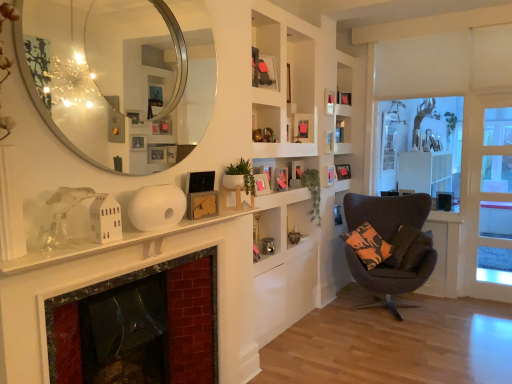
In order to face wooden picture frame at upper center, placed as the fifth picture frame when sorted from front to back, should I rotate leftwards or rightwards?

Rotate right and turn 10.078 degrees.

The image size is (512, 384). What do you see at coordinates (117, 243) in the screenshot? I see `white matte fireplace mantle at center` at bounding box center [117, 243].

The height and width of the screenshot is (384, 512). What do you see at coordinates (120, 77) in the screenshot?
I see `silver/metallic mirror at upper left` at bounding box center [120, 77].

This screenshot has width=512, height=384. Describe the element at coordinates (345, 98) in the screenshot. I see `matte black picture frame at upper center, the 8th picture frame positioned from the left` at that location.

What are the coordinates of `matte black picture frame at upper center, which is the eighth picture frame in front-to-back order` in the screenshot? It's located at [x=345, y=98].

The image size is (512, 384). What do you see at coordinates (303, 128) in the screenshot?
I see `wooden picture frame at upper center, the 4th picture frame viewed from the front` at bounding box center [303, 128].

Locate an element on the screen. Image resolution: width=512 pixels, height=384 pixels. matte wooden picture frame at upper center, which ranks as the 9th picture frame in front-to-back order is located at coordinates (343, 171).

You are a GUI agent. You are given a task and a screenshot of the screen. Output one action in this format:
    pyautogui.click(x=<x>, y=<y>)
    Task: Click on the wooden picture frame at upper center, arranged as the fourth picture frame when viewed from the right
    The height and width of the screenshot is (384, 512).
    Given the screenshot: What is the action you would take?
    pyautogui.click(x=330, y=101)

From the picture: How much distance is there between silver/metallic mirror at upper left and wooden picture frame at upper center, which appears as the sixth picture frame when viewed from the back?

The distance of silver/metallic mirror at upper left from wooden picture frame at upper center, which appears as the sixth picture frame when viewed from the back, is 1.68 meters.

Which picture frame is the 4th one when counting from the back of the silver/metallic mirror at upper left? Please provide its 2D coordinates.

[(303, 128)]

Which object is positioned more to the right, silver/metallic mirror at upper left or wooden picture frame at upper center, which appears as the sixth picture frame when viewed from the back?

From the viewer's perspective, wooden picture frame at upper center, which appears as the sixth picture frame when viewed from the back, appears more on the right side.

Does point (145, 75) come behind point (308, 132)?

No.

Is orange-patterned fabric pillow at lower right facing towards clear glass door at right?

No.

Which is in front, orange-patterned fabric pillow at lower right or clear glass door at right?

orange-patterned fabric pillow at lower right is more forward.

Does orange-patterned fabric pillow at lower right have a greater height compared to clear glass door at right?

In fact, orange-patterned fabric pillow at lower right may be shorter than clear glass door at right.

Does matte black picture frame at upper center, the 8th picture frame positioned from the left, come in front of wooden picture frame at center, the 2th picture frame when ordered from front to back?

No, matte black picture frame at upper center, the 8th picture frame positioned from the left, is further to the viewer.

Considering the sizes of matte black picture frame at upper center, which is the 2th picture frame in right-to-left order, and wooden picture frame at center, the 8th picture frame when ordered from back to front, in the image, is matte black picture frame at upper center, which is the 2th picture frame in right-to-left order, taller or shorter than wooden picture frame at center, the 8th picture frame when ordered from back to front,?

Clearly, matte black picture frame at upper center, which is the 2th picture frame in right-to-left order, is shorter compared to wooden picture frame at center, the 8th picture frame when ordered from back to front.

Considering the positions of objects matte black picture frame at upper center, which is the eighth picture frame in front-to-back order, and wooden picture frame at center, the 8th picture frame when ordered from back to front, in the image provided, who is more to the right, matte black picture frame at upper center, which is the eighth picture frame in front-to-back order, or wooden picture frame at center, the 8th picture frame when ordered from back to front,?

matte black picture frame at upper center, which is the eighth picture frame in front-to-back order, is more to the right.

How distant is matte black picture frame at upper center, which is the eighth picture frame in front-to-back order, from wooden picture frame at center, the 8th picture frame when ordered from back to front?

The distance of matte black picture frame at upper center, which is the eighth picture frame in front-to-back order, from wooden picture frame at center, the 8th picture frame when ordered from back to front, is 5.34 feet.

From a real-world perspective, is wooden picture frame at center, which is the seventh picture frame from right to left, under silver/metallic mirror at upper left?

Yes, from a real-world perspective, wooden picture frame at center, which is the seventh picture frame from right to left, is under silver/metallic mirror at upper left.

Considering the sizes of objects wooden picture frame at center, which ranks as the third picture frame in front-to-back order, and silver/metallic mirror at upper left in the image provided, who is thinner, wooden picture frame at center, which ranks as the third picture frame in front-to-back order, or silver/metallic mirror at upper left?

wooden picture frame at center, which ranks as the third picture frame in front-to-back order.

Consider the image. What's the angular difference between wooden picture frame at center, which appears as the 3th picture frame when viewed from the left, and silver/metallic mirror at upper left's facing directions?

0.862 degrees.

Is silver/metallic mirror at upper left located within wooden picture frame at center, positioned as the 7th picture frame in back-to-front order?

No, silver/metallic mirror at upper left is not surrounded by wooden picture frame at center, positioned as the 7th picture frame in back-to-front order.

Can you confirm if wooden picture frame at upper center, the 7th picture frame viewed from the front, is wider than smooth black glass fireplace at lower left?

Incorrect, the width of wooden picture frame at upper center, the 7th picture frame viewed from the front, does not surpass that of smooth black glass fireplace at lower left.

Could you tell me if wooden picture frame at upper center, the 7th picture frame viewed from the front, is facing smooth black glass fireplace at lower left?

No, wooden picture frame at upper center, the 7th picture frame viewed from the front, is not turned towards smooth black glass fireplace at lower left.

Does wooden picture frame at upper center, the 7th picture frame viewed from the front, have a lesser height compared to smooth black glass fireplace at lower left?

Indeed, wooden picture frame at upper center, the 7th picture frame viewed from the front, has a lesser height compared to smooth black glass fireplace at lower left.

Between wooden picture frame at upper center, the 3th picture frame viewed from the back, and smooth black glass fireplace at lower left, which one appears on the left side from the viewer's perspective?

From the viewer's perspective, smooth black glass fireplace at lower left appears more on the left side.

Is wooden picture frame at upper center, the first picture frame viewed from the left, a part of white matte fireplace mantle at center?

No, wooden picture frame at upper center, the first picture frame viewed from the left, is not inside white matte fireplace mantle at center.

Visually, is white matte fireplace mantle at center positioned to the left or to the right of wooden picture frame at upper center, positioned as the 1th picture frame in front-to-back order?

Based on their positions, white matte fireplace mantle at center is located to the left of wooden picture frame at upper center, positioned as the 1th picture frame in front-to-back order.

Can you tell me how much white matte fireplace mantle at center and wooden picture frame at upper center, the first picture frame viewed from the left, differ in facing direction?

6.41 degrees separate the facing orientations of white matte fireplace mantle at center and wooden picture frame at upper center, the first picture frame viewed from the left.

From a real-world perspective, is white matte fireplace mantle at center above or below wooden picture frame at upper center, which is the 9th picture frame in back-to-front order?

white matte fireplace mantle at center is below wooden picture frame at upper center, which is the 9th picture frame in back-to-front order.

Where is `fireplace directly beneath the wooden picture frame at upper center, which appears as the sixth picture frame when viewed from the back (from a real-world perspective)`? fireplace directly beneath the wooden picture frame at upper center, which appears as the sixth picture frame when viewed from the back (from a real-world perspective) is located at coordinates (123, 283).

Looking at their sizes, would you say wooden picture frame at upper center, which appears as the sixth picture frame when viewed from the back, is wider or thinner than smooth black glass fireplace at lower left?

Considering their sizes, wooden picture frame at upper center, which appears as the sixth picture frame when viewed from the back, looks slimmer than smooth black glass fireplace at lower left.

Which object is positioned more to the left, wooden picture frame at upper center, the 4th picture frame viewed from the front, or smooth black glass fireplace at lower left?

smooth black glass fireplace at lower left is more to the left.

From the image's perspective, is wooden picture frame at upper center, which appears as the sixth picture frame when viewed from the back, located above or below smooth black glass fireplace at lower left?

Based on their image positions, wooden picture frame at upper center, which appears as the sixth picture frame when viewed from the back, is located above smooth black glass fireplace at lower left.

Identify the location of mirror in front of the wooden picture frame at upper center, the 4th picture frame viewed from the front. (120, 77).

Find the location of a particular element. Image resolution: width=512 pixels, height=384 pixels. pillow below the clear glass door at right (from the image's perspective) is located at coordinates (408, 248).

Considering their positions, is green matte plant at center, which appears as the 1th plant when viewed from the front, positioned closer to silver/metallic mirror at upper left than white wood window frame at right?

green matte plant at center, which appears as the 1th plant when viewed from the front, is closer to silver/metallic mirror at upper left.

Based on their spatial positions, is green matte plant at center, marked as the 1th plant in a back-to-front arrangement, or matte wooden picture frame at upper center, which is the first picture frame in back-to-front order, further from wooden picture frame at upper center, the 7th picture frame viewed from the front?

Based on the image, matte wooden picture frame at upper center, which is the first picture frame in back-to-front order, appears to be further to wooden picture frame at upper center, the 7th picture frame viewed from the front.

Estimate the real-world distances between objects in this image. Which object is closer to orange-patterned fabric pillow at lower right, clear glass door at right or matte black picture frame at upper center, which ranks as the 2th picture frame in back-to-front order?

clear glass door at right is positioned closer to the anchor orange-patterned fabric pillow at lower right.

Considering their positions, is orange-patterned fabric pillow at lower right positioned closer to white matte cabinet at upper center than wooden picture frame at upper center, positioned as the 6th picture frame in front-to-back order?

Based on the image, wooden picture frame at upper center, positioned as the 6th picture frame in front-to-back order, appears to be nearer to white matte cabinet at upper center.

Estimate the real-world distances between objects in this image. Which object is closer to clear glass door at right, wooden picture frame at upper center, the 7th picture frame viewed from the front, or green matte plant at center, the 2th plant positioned from the right?

wooden picture frame at upper center, the 7th picture frame viewed from the front.

Based on their spatial positions, is clear glass door at right or white wood window frame at right further from wooden picture frame at center, which is the seventh picture frame from right to left?

Among the two, clear glass door at right is located further to wooden picture frame at center, which is the seventh picture frame from right to left.

Based on their spatial positions, is white wood window frame at right or orange-patterned fabric pillow at lower right closer to matte wooden picture frame at upper center, the 1th picture frame positioned from the right?

orange-patterned fabric pillow at lower right lies closer to matte wooden picture frame at upper center, the 1th picture frame positioned from the right, than the other object.

When comparing their distances from wooden picture frame at center, placed as the second picture frame when sorted from left to right, does green matte plant at center, the second plant from the back, or white wood window frame at right seem further?

The object further to wooden picture frame at center, placed as the second picture frame when sorted from left to right, is white wood window frame at right.

At what (x,y) coordinates should I click in order to perform the action: click on window frame situated between green matte plant at center, marked as the 1th plant in a left-to-right arrangement, and clear glass door at right from left to right. Please return your answer as a coordinate pair (x, y). This screenshot has width=512, height=384. Looking at the image, I should click on (465, 193).

Identify the location of cabinet between smooth black glass fireplace at lower left and wooden picture frame at upper center, the 5th picture frame viewed from the back, from front to back. The height and width of the screenshot is (384, 512). (284, 84).

The height and width of the screenshot is (384, 512). What are the coordinates of `cabinet positioned between green matte plant at center, the 2th plant positioned from the right, and green matte plant at center, placed as the 2th plant when sorted from front to back, from near to far` in the screenshot? It's located at (284, 84).

Locate an element on the screen. This screenshot has height=384, width=512. mirror located between white matte fireplace mantle at center and dark gray fabric chair at right in the depth direction is located at coordinates (120, 77).